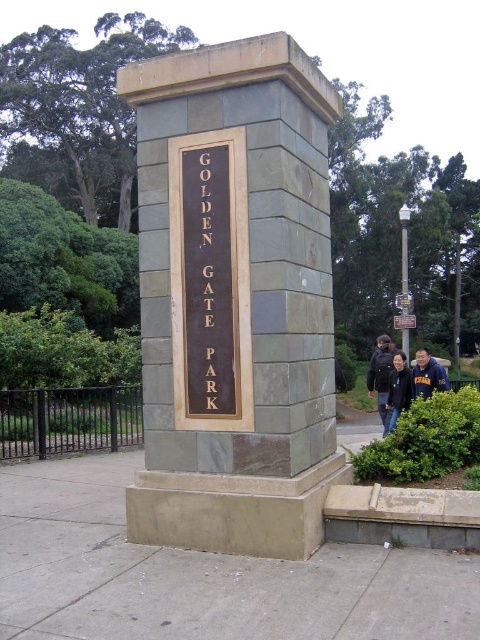
Question: Among these objects, which one is nearest to the camera?

Choices:
 (A) dark blue jacket at right
 (B) black fabric jacket at lower right
 (C) goldmaterial/texture sign at center

Answer: (C)

Question: Does goldmaterial/texture sign at center have a greater width compared to dark blue jacket at right?

Choices:
 (A) no
 (B) yes

Answer: (A)

Question: Can you confirm if gray stone sign at center is positioned below blue fleece jacket at lower right?

Choices:
 (A) no
 (B) yes

Answer: (A)

Question: Among these points, which one is nearest to the camera?

Choices:
 (A) (383, 355)
 (B) (197, 193)
 (C) (407, 385)

Answer: (B)

Question: Does gold polished metal sign at center have a greater width compared to goldmaterial/texture sign at center?

Choices:
 (A) yes
 (B) no

Answer: (A)

Question: Which of the following is the closest to the observer?

Choices:
 (A) (429, 381)
 (B) (194, 284)
 (C) (187, 458)

Answer: (C)